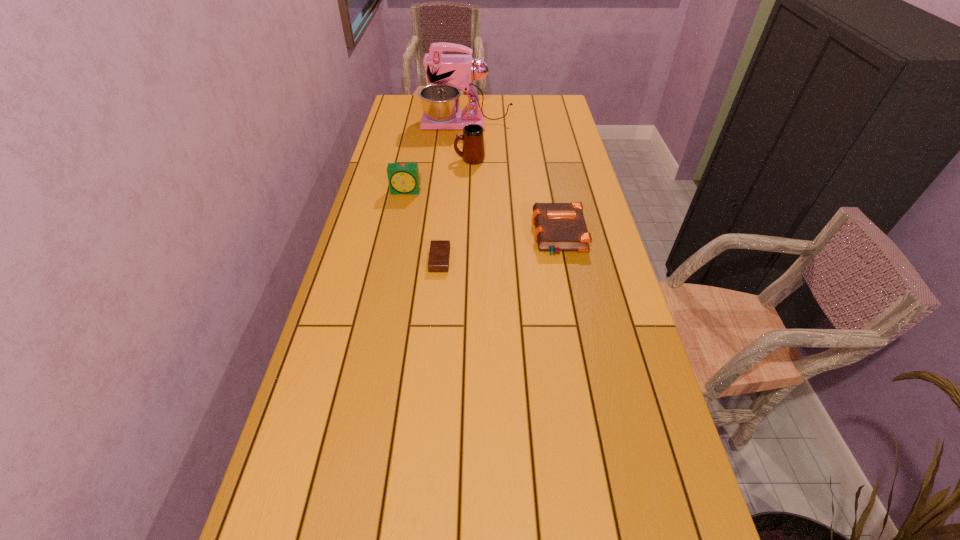
I want to click on vacant space that satisfies the following two spatial constraints: 1. on the face of the mixer; 2. on the front-facing side of the left alarm clock, so [464, 192].

You are a GUI agent. You are given a task and a screenshot of the screen. Output one action in this format:
    pyautogui.click(x=<x>, y=<y>)
    Task: Click on the vacant space that satisfies the following two spatial constraints: 1. on the side of the second farthest object with the handle; 2. on the front-facing side of the farther alarm clock
    This screenshot has width=960, height=540.
    Given the screenshot: What is the action you would take?
    pyautogui.click(x=468, y=192)